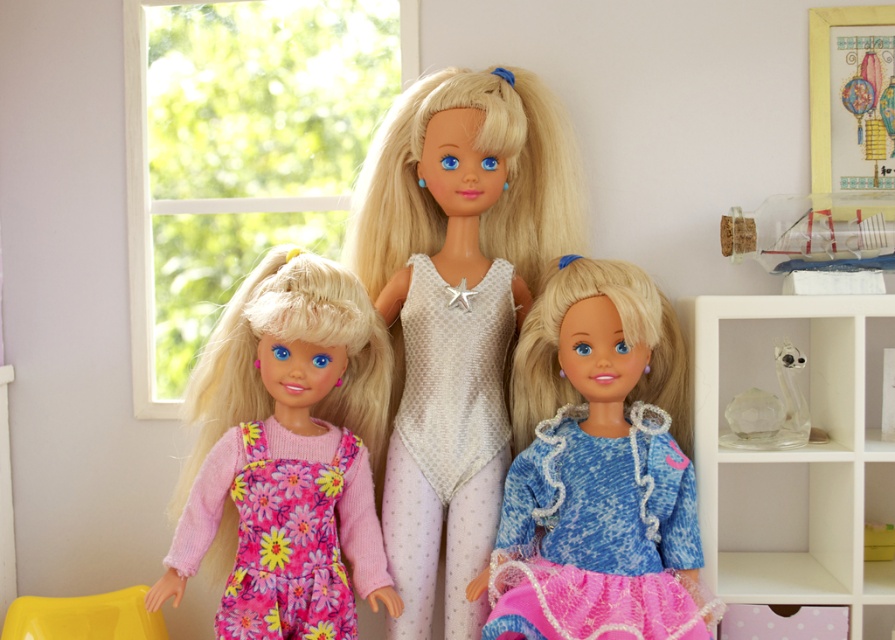
You are a parent helping your child choose a doll to dress. You have two dresses available, the white dotted fabric dress at center and the fluffy pink fabric dress at left. The child wants to put a dress on the doll that is currently visible. Which dress should you choose?

The white dotted fabric dress at center is located above the fluffy pink fabric dress at left, so the white dotted fabric dress at center is more visible and should be chosen.